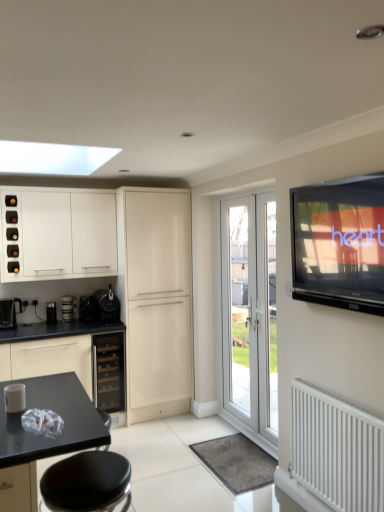
Locate an element on the screen. white metal radiator at lower right is located at coordinates (337, 449).

Locate an element on the screen. The height and width of the screenshot is (512, 384). glossy cream cabinet at center, which appears as the 2th cabinetry when viewed from the left is located at coordinates (156, 300).

Image resolution: width=384 pixels, height=512 pixels. What do you see at coordinates (87, 482) in the screenshot? I see `black leather bar stool at lower left` at bounding box center [87, 482].

What is the approximate height of white glossy door at center?

white glossy door at center is 2.05 meters tall.

The height and width of the screenshot is (512, 384). Identify the location of flat-screen tv at upper right. (339, 243).

Would you say white glossy cabinet at upper left, placed as the second cabinetry when sorted from right to left, is part of glossy cream cabinet at center, placed as the 1th cabinetry when sorted from right to left,'s contents?

No, white glossy cabinet at upper left, placed as the second cabinetry when sorted from right to left, is not inside glossy cream cabinet at center, placed as the 1th cabinetry when sorted from right to left.

Between glossy cream cabinet at center, placed as the 1th cabinetry when sorted from right to left, and white glossy cabinet at upper left, placed as the 1th cabinetry when sorted from left to right, which one appears on the left side from the viewer's perspective?

white glossy cabinet at upper left, placed as the 1th cabinetry when sorted from left to right.

Considering the relative positions of glossy cream cabinet at center, which appears as the 2th cabinetry when viewed from the left, and white glossy cabinet at upper left, placed as the 1th cabinetry when sorted from left to right, in the image provided, is glossy cream cabinet at center, which appears as the 2th cabinetry when viewed from the left, in front of white glossy cabinet at upper left, placed as the 1th cabinetry when sorted from left to right,?

No, glossy cream cabinet at center, which appears as the 2th cabinetry when viewed from the left, is further to the viewer.

In the scene shown: Is glossy cream cabinet at center, which appears as the 2th cabinetry when viewed from the left, not near white glossy cabinet at upper left, placed as the 1th cabinetry when sorted from left to right?

No, glossy cream cabinet at center, which appears as the 2th cabinetry when viewed from the left, is not far from white glossy cabinet at upper left, placed as the 1th cabinetry when sorted from left to right.

Would you consider white metal radiator at lower right to be distant from black leather bar stool at lower left?

Indeed, white metal radiator at lower right is not near black leather bar stool at lower left.

Considering the sizes of objects white metal radiator at lower right and black leather bar stool at lower left in the image provided, who is wider, white metal radiator at lower right or black leather bar stool at lower left?

With larger width is black leather bar stool at lower left.

Is white metal radiator at lower right positioned with its back to black leather bar stool at lower left?

No, black leather bar stool at lower left is not at the back of white metal radiator at lower right.

Considering the sizes of objects white metal radiator at lower right and black leather bar stool at lower left in the image provided, who is shorter, white metal radiator at lower right or black leather bar stool at lower left?

black leather bar stool at lower left is shorter.

Which of these two, white glossy door at center or white metal radiator at lower right, is wider?

Wider between the two is white metal radiator at lower right.

Is white glossy door at center positioned beyond the bounds of white metal radiator at lower right?

Indeed, white glossy door at center is completely outside white metal radiator at lower right.

In the scene shown: From the image's perspective, is white glossy door at center above white metal radiator at lower right?

Correct, white glossy door at center appears higher than white metal radiator at lower right in the image.

At what (x,y) coordinates should I click in order to perform the action: click on radiator on the right of white glossy door at center. Please return your answer as a coordinate pair (x, y). Looking at the image, I should click on (337, 449).

From a real-world perspective, is metallic silver cup at left, marked as the 2th appliance in a left-to-right arrangement, located beneath satin black wine cooler at center?

No, from a real-world perspective, metallic silver cup at left, marked as the 2th appliance in a left-to-right arrangement, is not under satin black wine cooler at center.

From the satin black wine cooler at center, count 4th appliances backward and point to it. Please provide its 2D coordinates.

[(68, 307)]

Does metallic silver cup at left, placed as the third appliance when sorted from right to left, have a smaller size compared to satin black wine cooler at center?

Correct, metallic silver cup at left, placed as the third appliance when sorted from right to left, occupies less space than satin black wine cooler at center.

In the image, is metallic silver cup at left, marked as the 2th appliance in a left-to-right arrangement, on the left side or the right side of flat-screen tv at upper right?

metallic silver cup at left, marked as the 2th appliance in a left-to-right arrangement, is positioned on flat-screen tv at upper right's left side.

From a real-world perspective, is metallic silver cup at left, marked as the 2th appliance in a left-to-right arrangement, physically located above or below flat-screen tv at upper right?

In terms of real-world spatial position, metallic silver cup at left, marked as the 2th appliance in a left-to-right arrangement, is below flat-screen tv at upper right.

Are metallic silver cup at left, marked as the 2th appliance in a left-to-right arrangement, and flat-screen tv at upper right making contact?

No, metallic silver cup at left, marked as the 2th appliance in a left-to-right arrangement, is not touching flat-screen tv at upper right.

Considering the sizes of objects metallic silver cup at left, placed as the third appliance when sorted from right to left, and flat-screen tv at upper right in the image provided, who is shorter, metallic silver cup at left, placed as the third appliance when sorted from right to left, or flat-screen tv at upper right?

With less height is metallic silver cup at left, placed as the third appliance when sorted from right to left.

Considering the sizes of objects glossy cream cabinet at center, which appears as the 2th cabinetry when viewed from the left, and black matte coffee maker at lower left, acting as the 3th appliance starting from the left, in the image provided, who is shorter, glossy cream cabinet at center, which appears as the 2th cabinetry when viewed from the left, or black matte coffee maker at lower left, acting as the 3th appliance starting from the left,?

Standing shorter between the two is black matte coffee maker at lower left, acting as the 3th appliance starting from the left.

Which is less distant, [151,337] or [88,311]?

Point [151,337].

Identify the location of the 2nd appliance to the left when counting from the glossy cream cabinet at center, which appears as the 2th cabinetry when viewed from the left. (88, 309).

Can you confirm if glossy cream cabinet at center, which appears as the 2th cabinetry when viewed from the left, is thinner than black matte coffee maker at lower left, acting as the second appliance starting from the right?

No, glossy cream cabinet at center, which appears as the 2th cabinetry when viewed from the left, is not thinner than black matte coffee maker at lower left, acting as the second appliance starting from the right.

From the image's perspective, is white metal radiator at lower right over glossy cream cabinet at center, which appears as the 2th cabinetry when viewed from the left?

No.

Which is closer to the camera, (375, 440) or (150, 336)?

The point (375, 440) is closer.

Is white metal radiator at lower right inside the boundaries of glossy cream cabinet at center, placed as the 1th cabinetry when sorted from right to left, or outside?

white metal radiator at lower right is not inside glossy cream cabinet at center, placed as the 1th cabinetry when sorted from right to left, it's outside.

Could you tell me if white metal radiator at lower right is facing glossy cream cabinet at center, placed as the 1th cabinetry when sorted from right to left?

No.

This screenshot has height=512, width=384. I want to click on cabinetry above the glossy cream cabinet at center, placed as the 1th cabinetry when sorted from right to left (from the image's perspective), so click(x=58, y=234).

Where is `bar stool on the left of the white metal radiator at lower right`? The width and height of the screenshot is (384, 512). bar stool on the left of the white metal radiator at lower right is located at coordinates (87, 482).

Which object lies nearer to the anchor point matte black coffee maker at left, which ranks as the fourth appliance in right-to-left order, black matte coffee maker at lower left, acting as the 3th appliance starting from the left, or satin black wine cooler at center?

black matte coffee maker at lower left, acting as the 3th appliance starting from the left.

Looking at the image, which one is located further to matte black coffee maker at left, the 1th appliance when ordered from left to right, black plastic coffee machine at left or black leather bar stool at lower left?

black leather bar stool at lower left is further to matte black coffee maker at left, the 1th appliance when ordered from left to right.

Estimate the real-world distances between objects in this image. Which object is further from white glossy door at center, white metal radiator at lower right or black matte coffee maker at lower left, acting as the second appliance starting from the right?

Among the two, black matte coffee maker at lower left, acting as the second appliance starting from the right, is located further to white glossy door at center.

From the image, which object appears to be nearer to white metal radiator at lower right, black matte coffee maker at lower left, acting as the second appliance starting from the right, or satin black wine cooler at center?

satin black wine cooler at center is positioned closer to the anchor white metal radiator at lower right.

Estimate the real-world distances between objects in this image. Which object is further from black leather bar stool at lower left, metallic silver cup at left, marked as the 2th appliance in a left-to-right arrangement, or glossy cream cabinet at center, placed as the 1th cabinetry when sorted from right to left?

The object further to black leather bar stool at lower left is metallic silver cup at left, marked as the 2th appliance in a left-to-right arrangement.

Based on their spatial positions, is black leather bar stool at lower left or matte black coffee maker at left, which ranks as the fourth appliance in right-to-left order, further from white metal radiator at lower right?

matte black coffee maker at left, which ranks as the fourth appliance in right-to-left order, is further to white metal radiator at lower right.

Which object lies further to the anchor point satin black coffee machine at lower center, positioned as the first appliance in right-to-left order, matte black coffee maker at left, which ranks as the fourth appliance in right-to-left order, or black plastic coffee machine at left?

black plastic coffee machine at left lies further to satin black coffee machine at lower center, positioned as the first appliance in right-to-left order, than the other object.

Which object lies further to the anchor point white metal radiator at lower right, black matte coffee maker at lower left, acting as the second appliance starting from the right, or black plastic coffee machine at left?

black plastic coffee machine at left is positioned further to the anchor white metal radiator at lower right.

Image resolution: width=384 pixels, height=512 pixels. I want to click on radiator between black leather bar stool at lower left and black matte coffee maker at lower left, acting as the second appliance starting from the right, from front to back, so click(x=337, y=449).

Where is `radiator between matte black coffee maker at left, which ranks as the fourth appliance in right-to-left order, and flat-screen tv at upper right`? The height and width of the screenshot is (512, 384). radiator between matte black coffee maker at left, which ranks as the fourth appliance in right-to-left order, and flat-screen tv at upper right is located at coordinates (337, 449).

Locate an element on the screen. This screenshot has height=512, width=384. radiator between black leather bar stool at lower left and glossy cream cabinet at center, which appears as the 2th cabinetry when viewed from the left, in the front-back direction is located at coordinates (337, 449).

The image size is (384, 512). Identify the location of television between black leather bar stool at lower left and metallic silver cup at left, marked as the 2th appliance in a left-to-right arrangement, along the z-axis. (339, 243).